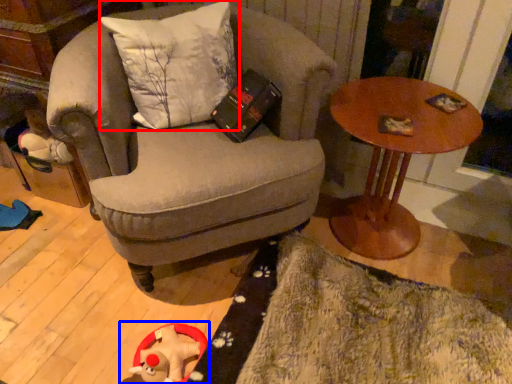
Question: Which point is further to the camera, pillow (highlighted by a red box) or toy (highlighted by a blue box)?

Choices:
 (A) pillow
 (B) toy

Answer: (B)